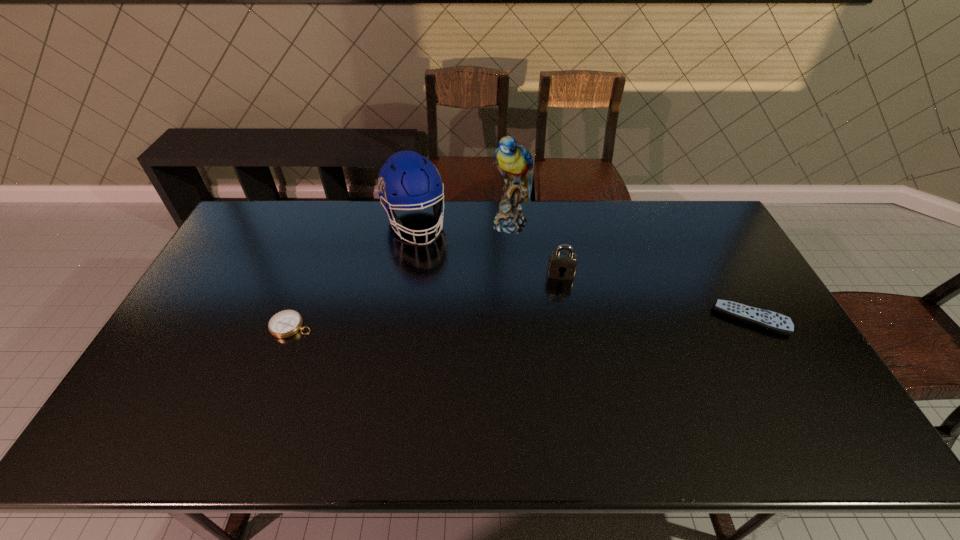
Locate an element on the screen. This screenshot has height=540, width=960. free space on the desktop that is between the compass and the rightmost object and is positioned on the face of the tallest object is located at coordinates (504, 323).

I want to click on free space on the desktop that is between the leftmost object and the rightmost object and is positioned on the front-facing side of the fourth shortest object, so click(461, 323).

Locate an element on the screen. Image resolution: width=960 pixels, height=540 pixels. free space on the desktop that is between the compass and the rightmost object and is positioned at the front of the padlock near the keyhole is located at coordinates (562, 322).